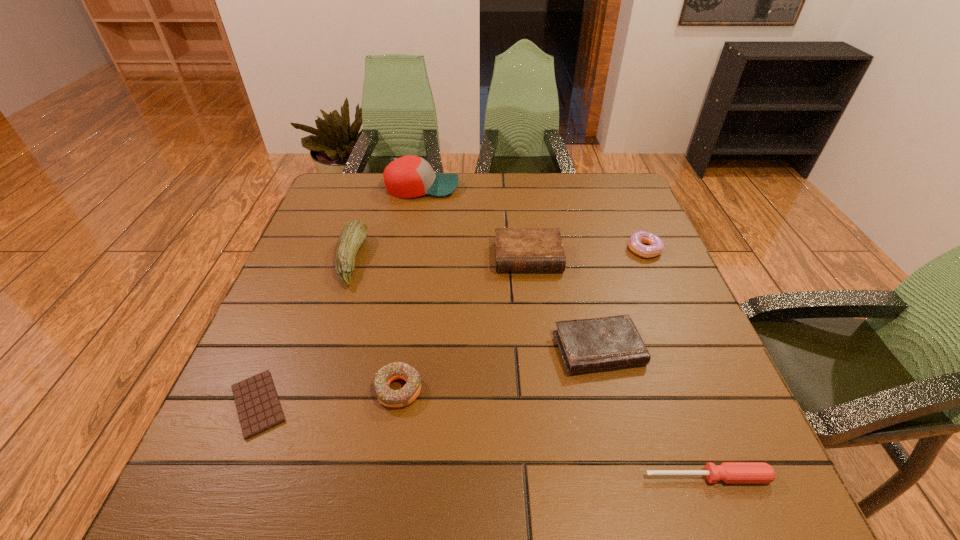
Identify which object is the second closest to the nearer doughnut. Please provide its 2D coordinates. Your answer should be formatted as a tuple, i.e. [(x, y)], where the tuple contains the x and y coordinates of a point satisfying the conditions above.

[(354, 232)]

Where is `vacant space that satisfies the following two spatial constraints: 1. on the spine side of the nearest object; 2. on the left side of the third tallest object`? vacant space that satisfies the following two spatial constraints: 1. on the spine side of the nearest object; 2. on the left side of the third tallest object is located at coordinates (555, 477).

Locate an element on the screen. vacant space that satisfies the following two spatial constraints: 1. at the brim of the farthest object; 2. on the back side of the right doughnut is located at coordinates (411, 249).

Identify the location of blank space that satisfies the following two spatial constraints: 1. at the brim of the right doughnut; 2. on the left side of the tallest object. click(411, 249).

Identify the location of free location that satisfies the following two spatial constraints: 1. at the brim of the farthest object; 2. on the back side of the shorter diary. (394, 349).

At what (x,y) coordinates should I click in order to perform the action: click on free location that satisfies the following two spatial constraints: 1. on the spine side of the shorter diary; 2. on the right side of the taller diary. Please return your answer as a coordinate pair (x, y). This screenshot has height=540, width=960. Looking at the image, I should click on (539, 349).

Where is `vacant region that satisfies the following two spatial constraints: 1. at the stem end of the zucchini; 2. on the back side of the left doughnut`? The width and height of the screenshot is (960, 540). vacant region that satisfies the following two spatial constraints: 1. at the stem end of the zucchini; 2. on the back side of the left doughnut is located at coordinates (309, 389).

Locate an element on the screen. The image size is (960, 540). vacant space that satisfies the following two spatial constraints: 1. at the brim of the left doughnut; 2. on the right side of the farthest object is located at coordinates (386, 389).

The height and width of the screenshot is (540, 960). I want to click on vacant space that satisfies the following two spatial constraints: 1. at the stem end of the nearer diary; 2. on the right side of the zucchini, so click(323, 349).